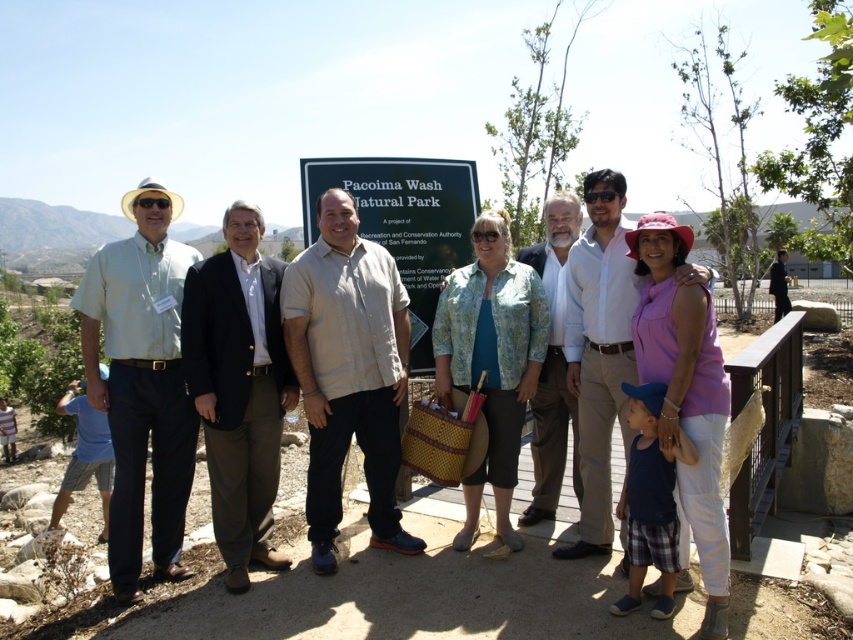
Question: Is beige cotton shirt at center thinner than paisley-patterned blazer at center?

Choices:
 (A) no
 (B) yes

Answer: (A)

Question: Which point is farther to the camera?

Choices:
 (A) (553, 298)
 (B) (312, 388)
 (C) (189, 252)
 (D) (311, 416)

Answer: (A)

Question: Which point is closer to the camera?

Choices:
 (A) (544, 356)
 (B) (396, 545)
 (C) (189, 481)

Answer: (C)

Question: Does matte beige shirt at center appear on the right side of black wool suit at center?

Choices:
 (A) yes
 (B) no

Answer: (A)

Question: Is beige cotton shirt at center further to the viewer compared to black wool suit at center?

Choices:
 (A) yes
 (B) no

Answer: (A)

Question: Estimate the real-world distances between objects in this image. Which object is farther from the matte beige shirt at center?

Choices:
 (A) black plastic sign at center
 (B) black wool suit at center

Answer: (B)